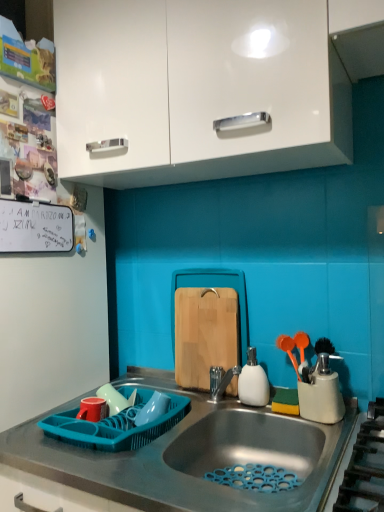
Image resolution: width=384 pixels, height=512 pixels. What are the coordinates of `vacant area that lies in front of white matte soap dispenser at sink, which is the 2th appliance in left-to-right order` in the screenshot? It's located at (284, 421).